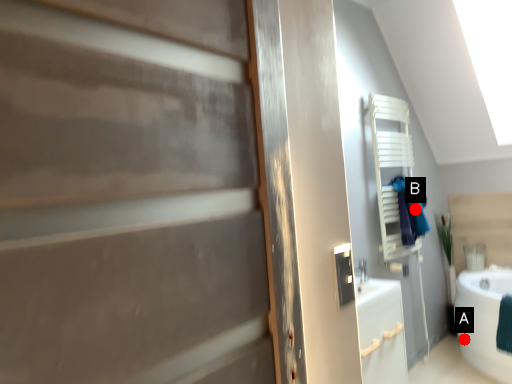
Question: Two points are circled on the image, labeled by A and B beside each circle. Which of the following is the farthest from the observer?

Choices:
 (A) A is further
 (B) B is further

Answer: (A)